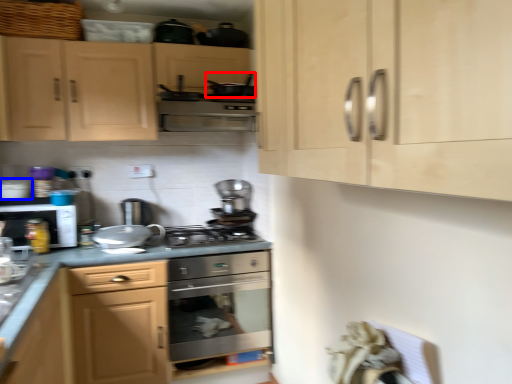
Question: Which object appears farthest to the camera in this image, appliance (highlighted by a red box) or appliance (highlighted by a blue box)?

Choices:
 (A) appliance
 (B) appliance

Answer: (B)